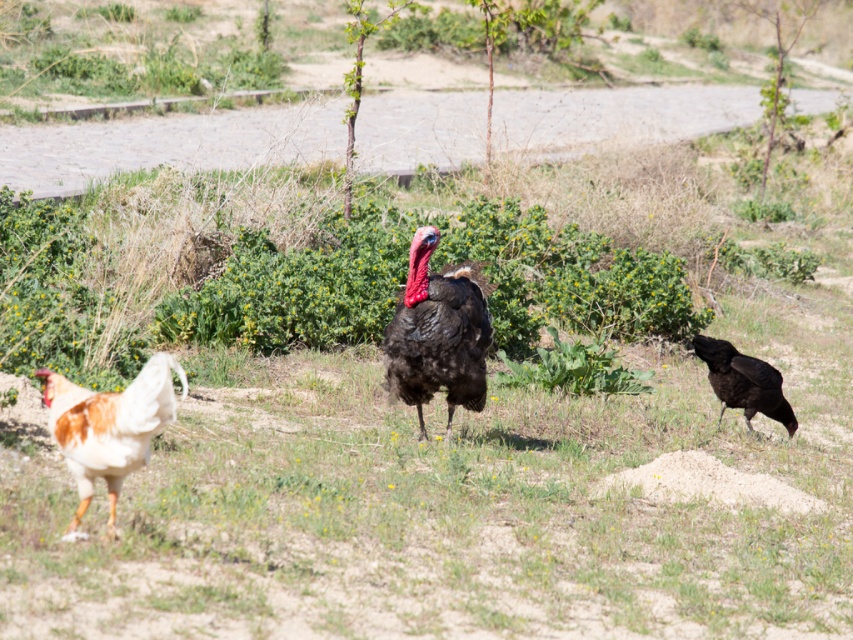
Can you confirm if shiny dark feathers turkey at center is positioned to the left of brown feathered chicken at left?

Incorrect, shiny dark feathers turkey at center is not on the left side of brown feathered chicken at left.

Can you confirm if shiny dark feathers turkey at center is taller than brown feathered chicken at left?

Yes, shiny dark feathers turkey at center is taller than brown feathered chicken at left.

This screenshot has width=853, height=640. Describe the element at coordinates (438, 333) in the screenshot. I see `shiny dark feathers turkey at center` at that location.

I want to click on shiny dark feathers turkey at center, so click(438, 333).

Is brown feathered chicken at left closer to the viewer compared to shiny black turkey at right?

That is True.

Can you confirm if brown feathered chicken at left is positioned to the right of shiny black turkey at right?

In fact, brown feathered chicken at left is to the left of shiny black turkey at right.

Is point (80, 404) behind point (735, 362)?

No, it is not.

The width and height of the screenshot is (853, 640). I want to click on brown feathered chicken at left, so click(x=109, y=426).

Can you confirm if shiny dark feathers turkey at center is shorter than shiny black turkey at right?

In fact, shiny dark feathers turkey at center may be taller than shiny black turkey at right.

Describe the element at coordinates (438, 333) in the screenshot. The image size is (853, 640). I see `shiny dark feathers turkey at center` at that location.

Identify the location of shiny dark feathers turkey at center. (438, 333).